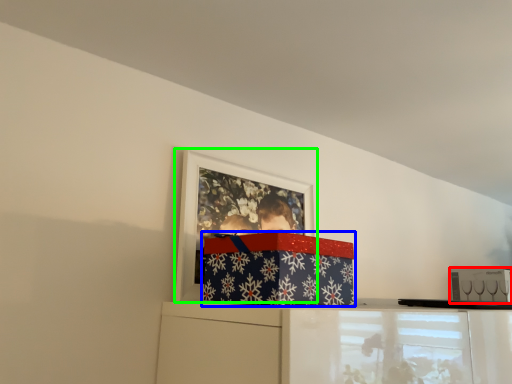
Question: Considering the real-world distances, which object is farthest from box (highlighted by a red box)? package (highlighted by a blue box) or picture frame (highlighted by a green box)?

Choices:
 (A) package
 (B) picture frame

Answer: (A)